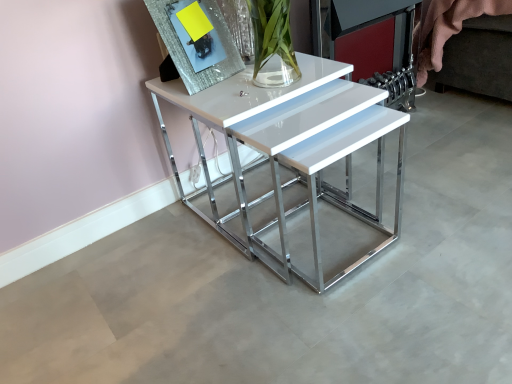
What are the coordinates of `vacant space to the right of white glossy table at center` in the screenshot? It's located at (422, 183).